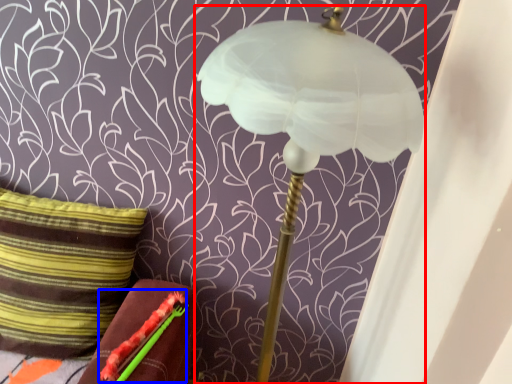
Question: Which of the following is the closest to the observer, lamp (highlighted by a red box) or flower (highlighted by a blue box)?

Choices:
 (A) lamp
 (B) flower

Answer: (A)